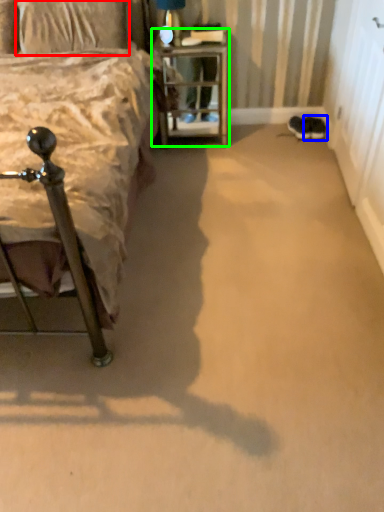
Question: Considering the real-world distances, which object is farthest from pillow (highlighted by a red box)? footwear (highlighted by a blue box) or nightstand (highlighted by a green box)?

Choices:
 (A) footwear
 (B) nightstand

Answer: (A)